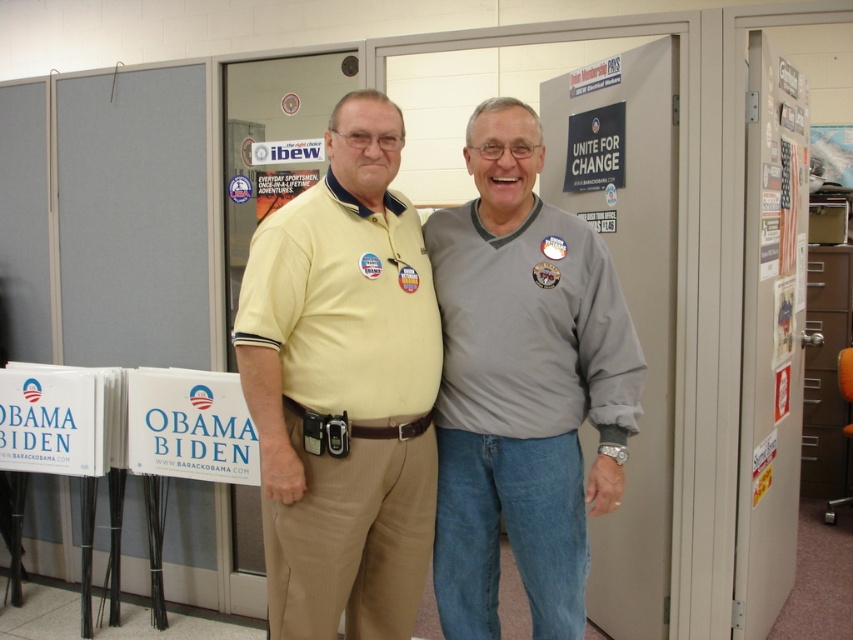
You are a photographer setting up for a photo shoot in this political campaign scene. You need to place a light exactly 6 feet away from the camera to ensure proper lighting. There is a point at coordinates point (369, 484) in the image. Can you use this point to determine if the light should be placed there?

The point (369, 484) is 6.25 feet from the camera, so placing the light there would be slightly too far since it needs to be exactly 6 feet away.

You are a campaign volunteer organizing materials in a room. You see the yellow cotton shirt at center and the sticky notes at right. Which object is closer to you?

The yellow cotton shirt at center is closer to you because it is in front of the sticky notes at right.

You are a campaign volunteer who needs to place a new sign on the wall. The sign is taller than the yellow cotton shirt at center but shorter than the sticky notes at right. Where should you place the new sign to ensure it fits properly?

The yellow cotton shirt at center is below sticky notes at right, so the new sign should be placed between them. Since the sign is taller than the yellow cotton shirt at center but shorter than the sticky notes at right, placing it above the yellow cotton shirt at center and below the sticky notes at right will ensure it fits properly.